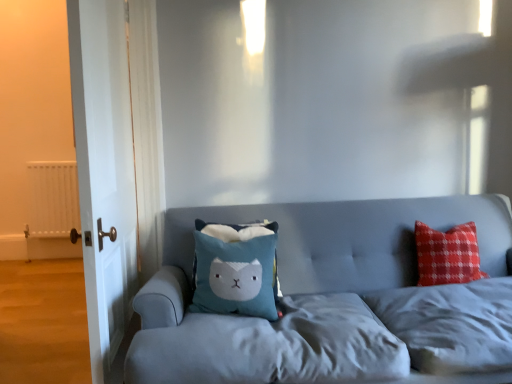
Question: Does white matte radiator at left come in front of velvet blue couch at center?

Choices:
 (A) no
 (B) yes

Answer: (A)

Question: Does white matte radiator at left turn towards velvet blue couch at center?

Choices:
 (A) yes
 (B) no

Answer: (B)

Question: From a real-world perspective, is white matte radiator at left positioned over velvet blue couch at center based on gravity?

Choices:
 (A) yes
 (B) no

Answer: (A)

Question: Does white matte radiator at left have a lesser height compared to velvet blue couch at center?

Choices:
 (A) no
 (B) yes

Answer: (A)

Question: Would you say white matte radiator at left is outside velvet blue couch at center?

Choices:
 (A) yes
 (B) no

Answer: (A)

Question: Does white matte radiator at left have a greater height compared to velvet blue couch at center?

Choices:
 (A) no
 (B) yes

Answer: (B)

Question: Would you say velvet blue couch at center is outside white wood door at left?

Choices:
 (A) no
 (B) yes

Answer: (B)

Question: Is there a large distance between velvet blue couch at center and white wood door at left?

Choices:
 (A) yes
 (B) no

Answer: (B)

Question: Is white wood door at left at the back of velvet blue couch at center?

Choices:
 (A) no
 (B) yes

Answer: (A)

Question: From the image's perspective, is velvet blue couch at center below white wood door at left?

Choices:
 (A) yes
 (B) no

Answer: (A)

Question: From a real-world perspective, is velvet blue couch at center under white wood door at left?

Choices:
 (A) no
 (B) yes

Answer: (B)

Question: Can you confirm if velvet blue couch at center is positioned to the right of white wood door at left?

Choices:
 (A) yes
 (B) no

Answer: (A)

Question: Could you tell me if white wood door at left is facing white matte radiator at left?

Choices:
 (A) yes
 (B) no

Answer: (B)